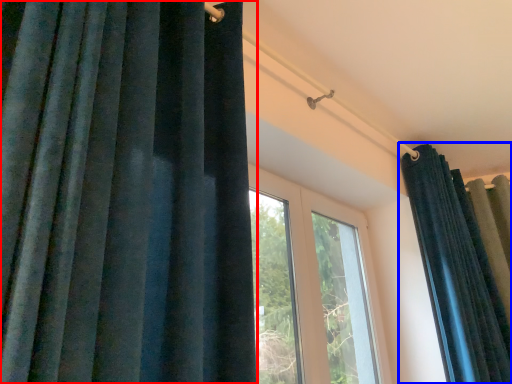
Question: Which object appears closest to the camera in this image, curtain (highlighted by a red box) or curtain (highlighted by a blue box)?

Choices:
 (A) curtain
 (B) curtain

Answer: (A)